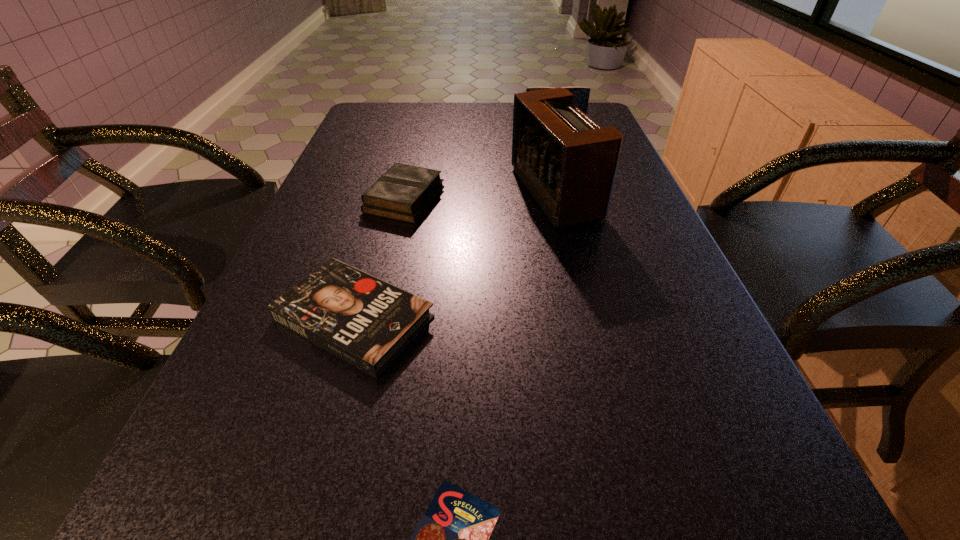
At what (x,y) coordinates should I click in order to perform the action: click on radio receiver. Please return your answer as a coordinate pair (x, y). This screenshot has height=540, width=960. Looking at the image, I should click on (568, 163).

Locate an element on the screen. the second tallest object is located at coordinates (581, 94).

At what (x,y) coordinates should I click in order to perform the action: click on the farthest book. Please return your answer as a coordinate pair (x, y). This screenshot has width=960, height=540. Looking at the image, I should click on (581, 94).

The height and width of the screenshot is (540, 960). What are the coordinates of `the second farthest book` in the screenshot? It's located at (404, 192).

This screenshot has height=540, width=960. I want to click on the third tallest object, so click(404, 192).

Identify the location of the shortest book. (367, 322).

Image resolution: width=960 pixels, height=540 pixels. Find the location of `the second nearest object`. the second nearest object is located at coordinates (367, 322).

At what (x,y) coordinates should I click in order to perform the action: click on free space located 0.250m on the back of the tallest object. Please return your answer as a coordinate pair (x, y). This screenshot has height=540, width=960. Looking at the image, I should click on (539, 124).

Find the location of a particular element. The height and width of the screenshot is (540, 960). vacant region located on the front cover of the farthest object is located at coordinates (571, 188).

The image size is (960, 540). Identify the location of vacant space situated 0.130m on the front of the third tallest object. (390, 262).